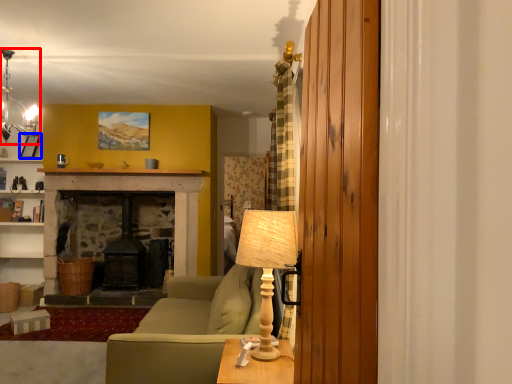
Question: Which object is closer to the camera taking this photo, lamp (highlighted by a red box) or picture frame (highlighted by a blue box)?

Choices:
 (A) lamp
 (B) picture frame

Answer: (A)